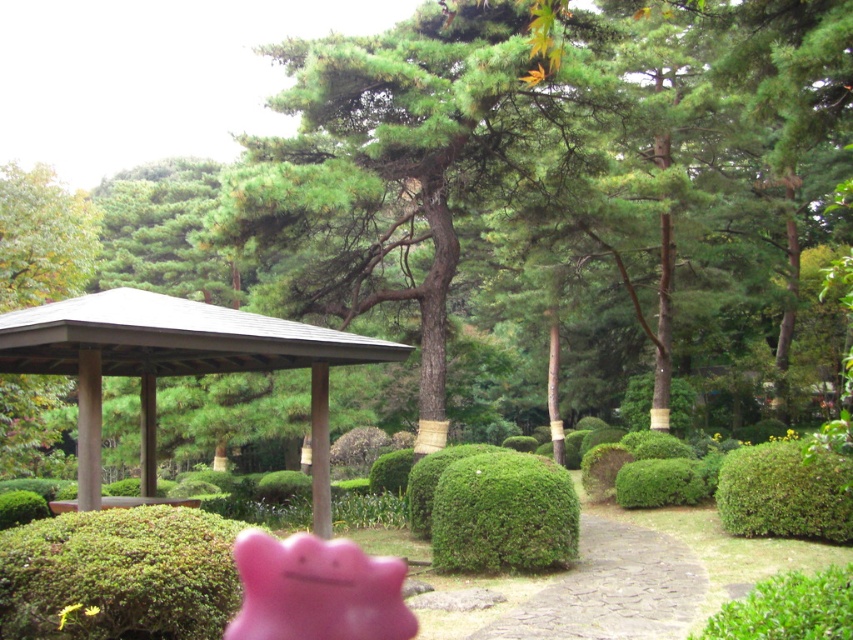
Question: Is green matte hedge at lower left positioned at the back of green textured hedge at center right?

Choices:
 (A) no
 (B) yes

Answer: (A)

Question: Is pink rubber toy at center bigger than green matte hedge at center?

Choices:
 (A) yes
 (B) no

Answer: (A)

Question: Is brown wooden gazebo at center further to the viewer compared to green matte hedge at lower left?

Choices:
 (A) yes
 (B) no

Answer: (A)

Question: Which of these objects is positioned farthest from the green matte hedge at lower left?

Choices:
 (A) green matte hedge at center
 (B) brown wooden gazebo at center
 (C) green textured hedge at center right
 (D) pink rubber toy at center

Answer: (C)

Question: Which point is closer to the camera taking this photo?

Choices:
 (A) (161, 561)
 (B) (802, 534)

Answer: (A)

Question: Which object is closer to the camera taking this photo?

Choices:
 (A) pink rubber toy at center
 (B) brown wooden gazebo at center
 (C) green textured hedge at center right
 (D) green matte hedge at lower left

Answer: (D)